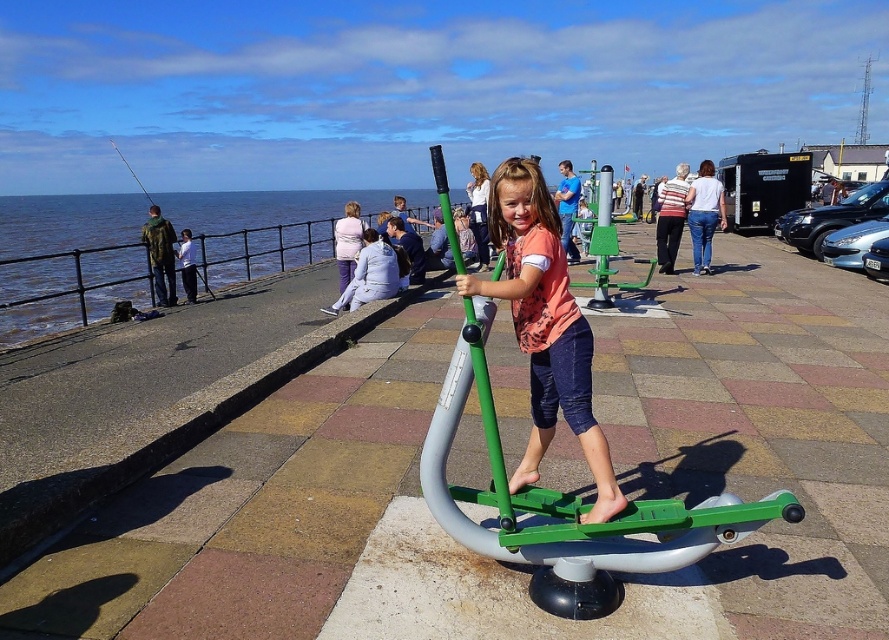
You are a photographer standing at the edge of the promenade. You want to take a photo of the green matte pole at center without the matte orange shirt at center blocking it. Based on the scene, where should you position yourself to achieve this?

Since the green matte pole at center is behind the matte orange shirt at center, you should position yourself behind the matte orange shirt at center to capture the green matte pole at center without obstruction.

You are a photographer trying to capture a photo of the matte orange shirt at center and the green matte pole at center. If you want to ensure both objects are in focus, which one should you adjust your camera focus to prioritize based on their sizes?

The matte orange shirt at center has a larger width than the green matte pole at center, so you should prioritize focusing on the matte orange shirt at center to ensure both are in focus.